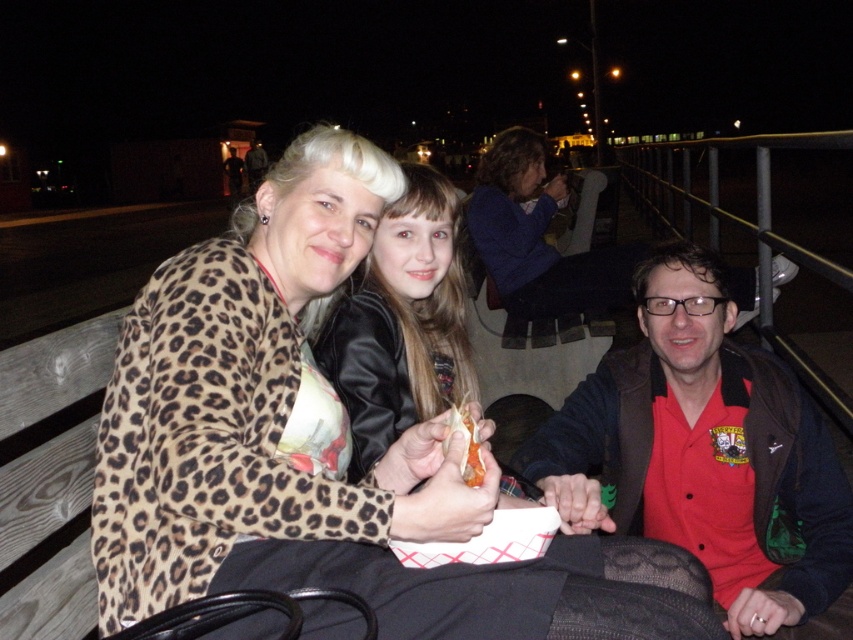
Question: Estimate the real-world distances between objects in this image. Which object is farther from the leopard print jacket at left?

Choices:
 (A) leather jacket at center
 (B) shiny orange carrot at center
 (C) red cotton shirt at right

Answer: (C)

Question: Is leopard print jacket at left below shiny orange carrot at center?

Choices:
 (A) no
 (B) yes

Answer: (A)

Question: Is the position of leopard print jacket at left more distant than that of leather jacket at center?

Choices:
 (A) no
 (B) yes

Answer: (A)

Question: Which is nearer to the red cotton shirt at right?

Choices:
 (A) leather jacket at center
 (B) shiny orange carrot at center
 (C) leopard print jacket at left

Answer: (A)

Question: Which of these objects is positioned farthest from the leopard print jacket at left?

Choices:
 (A) shiny orange carrot at center
 (B) leather jacket at center
 (C) red cotton shirt at right

Answer: (C)

Question: Is red cotton shirt at right bigger than leather jacket at center?

Choices:
 (A) yes
 (B) no

Answer: (A)